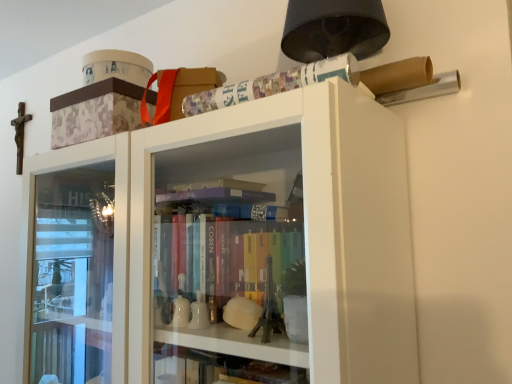
In order to face multicolored paper at upper right, should I rotate leftwards or rightwards?

To align with it, rotate right about 3.954°.

Consider the image. Measure the distance between multicolored paper at upper right and camera.

They are 21.90 inches apart.

Locate an element on the screen. multicolored paper at upper right is located at coordinates (272, 84).

What do you see at coordinates (272, 84) in the screenshot? I see `multicolored paper at upper right` at bounding box center [272, 84].

What is the approximate width of matte floral-patterned box at upper center?

matte floral-patterned box at upper center is 9.44 inches in width.

In order to face matte floral-patterned box at upper center, should I rotate leftwards or rightwards?

To face it directly, rotate left by 17.562 degrees.

I want to click on matte floral-patterned box at upper center, so click(95, 112).

Describe the element at coordinates (95, 112) in the screenshot. I see `matte floral-patterned box at upper center` at that location.

Find the location of `multicolored paper at upper right`. multicolored paper at upper right is located at coordinates (272, 84).

Considering the relative positions of multicolored paper at upper right and matte floral-patterned box at upper center in the image provided, is multicolored paper at upper right to the left of matte floral-patterned box at upper center from the viewer's perspective?

No, multicolored paper at upper right is not to the left of matte floral-patterned box at upper center.

Is multicolored paper at upper right closer to camera compared to matte floral-patterned box at upper center?

Yes, it is.

Is point (303, 73) closer to camera compared to point (62, 146)?

Yes, it is.

From the image's perspective, is multicolored paper at upper right under matte floral-patterned box at upper center?

Indeed, from the image's perspective, multicolored paper at upper right is shown beneath matte floral-patterned box at upper center.

From a real-world perspective, is multicolored paper at upper right above or below matte floral-patterned box at upper center?

multicolored paper at upper right is situated lower than matte floral-patterned box at upper center in the real world.

Can you confirm if multicolored paper at upper right is thinner than matte floral-patterned box at upper center?

Correct, the width of multicolored paper at upper right is less than that of matte floral-patterned box at upper center.

Considering the relative sizes of multicolored paper at upper right and matte floral-patterned box at upper center in the image provided, is multicolored paper at upper right taller than matte floral-patterned box at upper center?

No.

Considering the sizes of objects multicolored paper at upper right and matte floral-patterned box at upper center in the image provided, who is bigger, multicolored paper at upper right or matte floral-patterned box at upper center?

matte floral-patterned box at upper center.

Is matte floral-patterned box at upper center inside multicolored paper at upper right?

That's incorrect, matte floral-patterned box at upper center is not inside multicolored paper at upper right.

Is multicolored paper at upper right not near matte floral-patterned box at upper center?

No, multicolored paper at upper right is not far from matte floral-patterned box at upper center.

Is multicolored paper at upper right facing away from matte floral-patterned box at upper center?

No, matte floral-patterned box at upper center is not at the back of multicolored paper at upper right.

What's the angular difference between multicolored paper at upper right and matte floral-patterned box at upper center's facing directions?

0.00123 degrees separate the facing orientations of multicolored paper at upper right and matte floral-patterned box at upper center.

Measure the distance from multicolored paper at upper right to matte floral-patterned box at upper center.

multicolored paper at upper right and matte floral-patterned box at upper center are 9.20 inches apart from each other.

Where is `paperback book below the matte floral-patterned box at upper center (from a real-world perspective)`? Image resolution: width=512 pixels, height=384 pixels. paperback book below the matte floral-patterned box at upper center (from a real-world perspective) is located at coordinates coord(272,84).

Based on their positions, is matte floral-patterned box at upper center located to the left or right of multicolored paper at upper right?

matte floral-patterned box at upper center is positioned on multicolored paper at upper right's left side.

Does matte floral-patterned box at upper center lie behind multicolored paper at upper right?

Yes.

Which is farther, (x=84, y=132) or (x=320, y=61)?

The point (x=84, y=132) is behind.

From the image's perspective, is matte floral-patterned box at upper center on top of multicolored paper at upper right?

Yes, from the image's perspective, matte floral-patterned box at upper center is over multicolored paper at upper right.

Looking at this image, from a real-world perspective, which object rests below the other?

multicolored paper at upper right.

Which object is wider, matte floral-patterned box at upper center or multicolored paper at upper right?

matte floral-patterned box at upper center.

Which of these two, matte floral-patterned box at upper center or multicolored paper at upper right, stands shorter?

multicolored paper at upper right is shorter.

Based on their sizes in the image, would you say matte floral-patterned box at upper center is bigger or smaller than multicolored paper at upper right?

In the image, matte floral-patterned box at upper center appears to be larger than multicolored paper at upper right.

Is multicolored paper at upper right inside matte floral-patterned box at upper center?

No, multicolored paper at upper right is not a part of matte floral-patterned box at upper center.

Can you see matte floral-patterned box at upper center touching multicolored paper at upper right?

No, matte floral-patterned box at upper center is not touching multicolored paper at upper right.

Is multicolored paper at upper right at the back of matte floral-patterned box at upper center?

matte floral-patterned box at upper center is not turned away from multicolored paper at upper right.

Locate an element on the screen. This screenshot has width=512, height=384. paperback book located below the matte floral-patterned box at upper center (from the image's perspective) is located at coordinates (272, 84).

The image size is (512, 384). Find the location of `paperback book on the right side of matte floral-patterned box at upper center`. paperback book on the right side of matte floral-patterned box at upper center is located at coordinates (272, 84).

In the image, there is a matte floral-patterned box at upper center. Where is `paperback book below it (from the image's perspective)`? Image resolution: width=512 pixels, height=384 pixels. paperback book below it (from the image's perspective) is located at coordinates (272, 84).